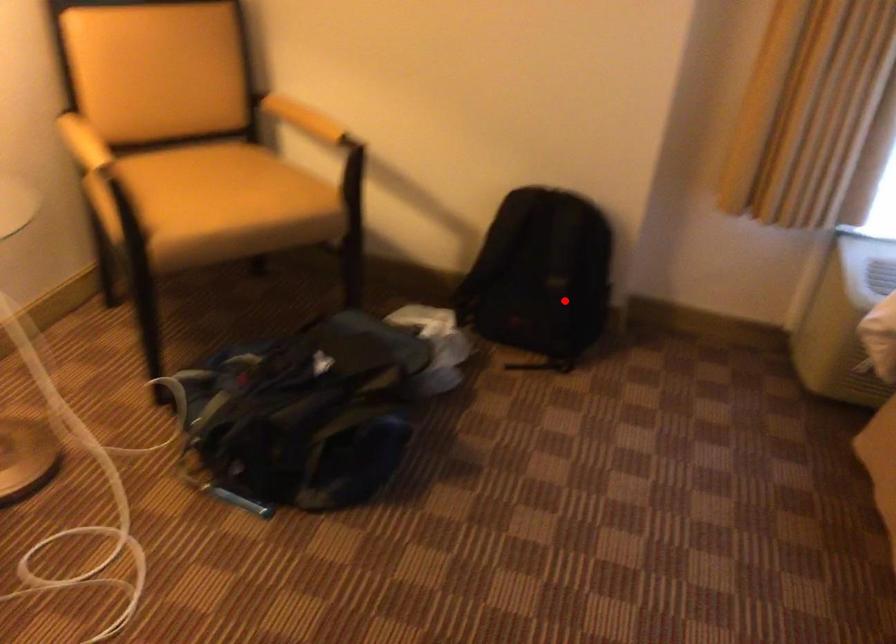
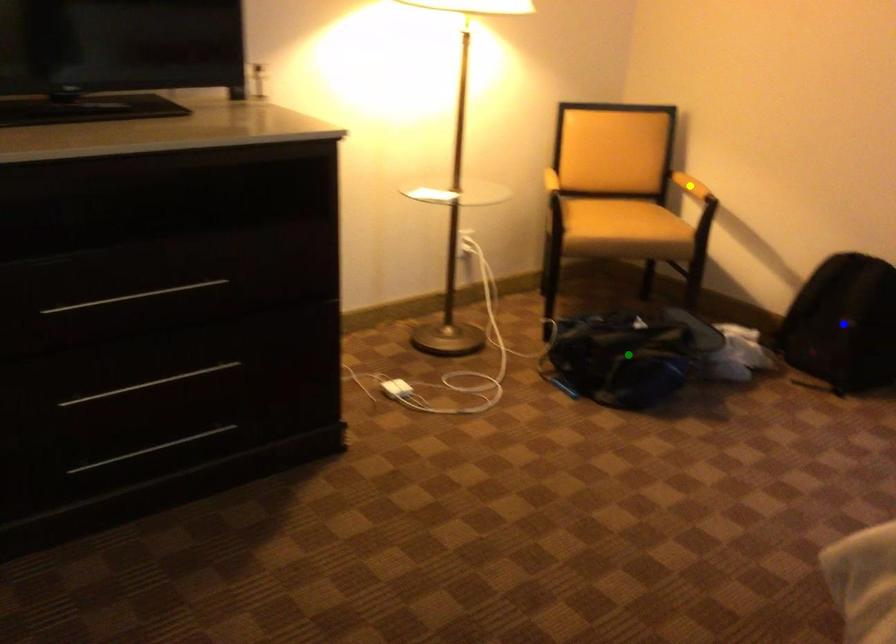
Question: I am providing you with two images of the same scene from different viewpoints. A red point is marked on the first image. You are given multiple points on the second image. Which mark in image 2 goes with the point in image 1?

Choices:
 (A) green point
 (B) blue point
 (C) yellow point

Answer: (B)